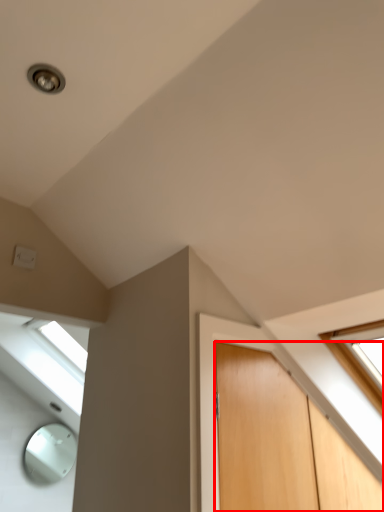
Question: From the image's perspective, considering the relative positions of door (annotated by the red box) and electric outlet in the image provided, where is door (annotated by the red box) located with respect to the staircase?

Choices:
 (A) below
 (B) above

Answer: (A)